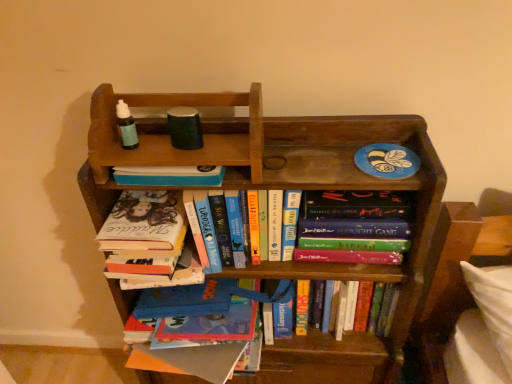
Question: From the image's perspective, is hardcover book at center, positioned as the first book in top-to-bottom order, located above or below wooden bookcase at center?

Choices:
 (A) below
 (B) above

Answer: (B)

Question: Do you think hardcover book at center, positioned as the first book in top-to-bottom order, is within wooden bookcase at center, or outside of it?

Choices:
 (A) outside
 (B) inside

Answer: (B)

Question: Which object is the farthest from the hardcover book at center, arranged as the first book when ordered from the bottom?

Choices:
 (A) wooden bookcase at center
 (B) hardcover book at center, positioned as the first book in top-to-bottom order
 (C) hardcover book at center, placed as the 2th book when sorted from bottom to top

Answer: (B)

Question: Estimate the real-world distances between objects in this image. Which object is closer to the hardcover book at center, acting as the 3th book starting from the bottom?

Choices:
 (A) hardcover book at center, placed as the 2th book when sorted from bottom to top
 (B) wooden bookcase at center
 (C) hardcover book at center, which appears as the 3th book when viewed from the top

Answer: (B)